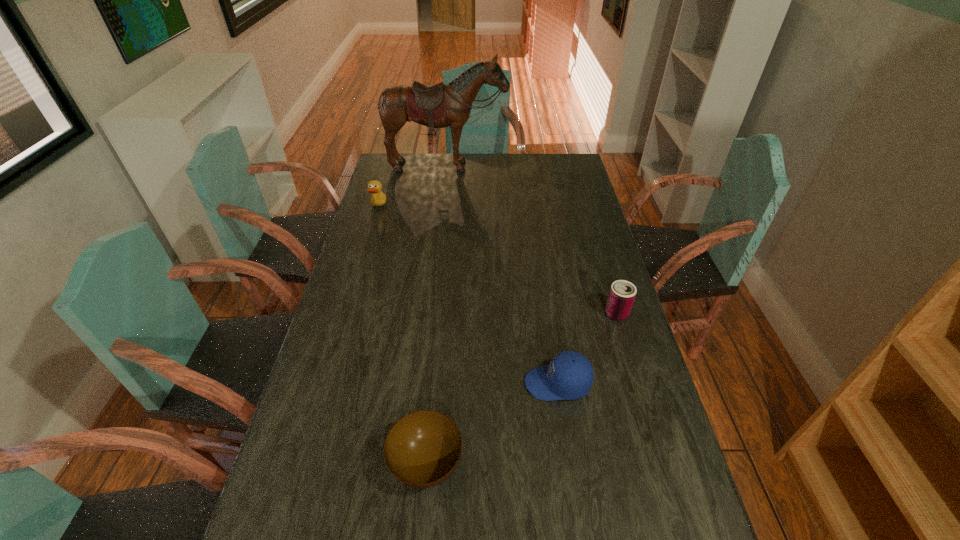
Locate an element on the screen. The image size is (960, 540). free spot between the duck and the bowl is located at coordinates (402, 336).

You are a GUI agent. You are given a task and a screenshot of the screen. Output one action in this format:
    pyautogui.click(x=<x>, y=<y>)
    Task: Click on the empty space that is in between the nearest object and the tallest object
    The image size is (960, 540).
    Given the screenshot: What is the action you would take?
    pyautogui.click(x=437, y=315)

Where is `vacant area that lies between the duck and the cap`? vacant area that lies between the duck and the cap is located at coordinates (468, 295).

Where is `object that ranks as the second closest to the rightmost object`? This screenshot has height=540, width=960. object that ranks as the second closest to the rightmost object is located at coordinates pos(422,449).

Identify the location of object that is the third closest to the tallest object. This screenshot has width=960, height=540. (569, 376).

This screenshot has height=540, width=960. In order to click on vacant area that satisfies the following two spatial constraints: 1. on the back of the third farthest object; 2. on the right side of the farthest object in this screenshot , I will do `click(431, 314)`.

Where is `vacant space that satisfies the following two spatial constraints: 1. on the beak of the bowl; 2. on the left side of the duck`? This screenshot has height=540, width=960. vacant space that satisfies the following two spatial constraints: 1. on the beak of the bowl; 2. on the left side of the duck is located at coordinates (302, 465).

Locate an element on the screen. This screenshot has height=540, width=960. free spot that satisfies the following two spatial constraints: 1. on the back of the saddle; 2. on the right side of the nearest object is located at coordinates (414, 465).

Find the location of a particular element. The width and height of the screenshot is (960, 540). vacant point that satisfies the following two spatial constraints: 1. on the back of the saddle; 2. on the beak of the duck is located at coordinates (443, 207).

This screenshot has width=960, height=540. I want to click on free point that satisfies the following two spatial constraints: 1. on the back side of the nearest object; 2. on the beak of the second farthest object, so click(x=449, y=207).